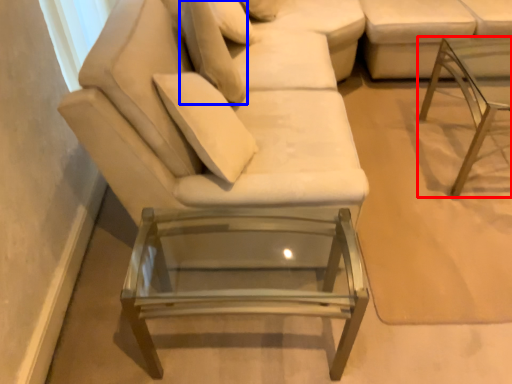
Question: Which object is further to the camera taking this photo, table (highlighted by a red box) or pillow (highlighted by a blue box)?

Choices:
 (A) table
 (B) pillow

Answer: (B)